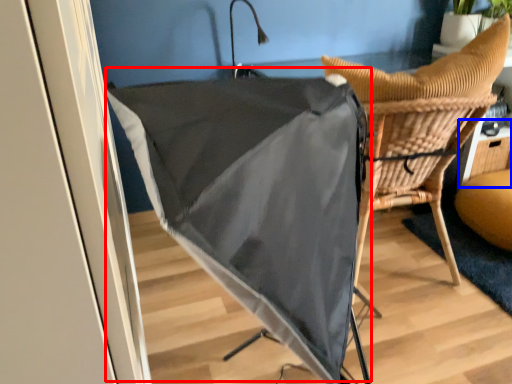
Question: Which point is further to the camera, umbrella (highlighted by a red box) or table (highlighted by a blue box)?

Choices:
 (A) umbrella
 (B) table

Answer: (B)